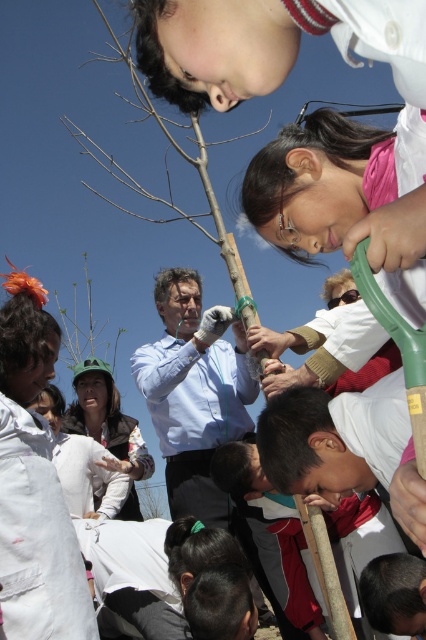
You are a gardener who needs to plant a new flower bed between the bare wood tree at center and the green leafy plant at center. The flower bed requires a minimum of 20 feet of space between them. Can you fit the flower bed in the available space?

The distance between the bare wood tree at center and the green leafy plant at center is 19.91 feet, which is slightly less than the required 20 feet. Therefore, the flower bed cannot be placed between them as there is insufficient space.

You are a gardener who wants to plant a new tree in your backyard. You have two options from the image, the bare wood tree at center and the green leafy plant at center. Which one is taller?

The bare wood tree at center is taller than the green leafy plant at center according to the description.